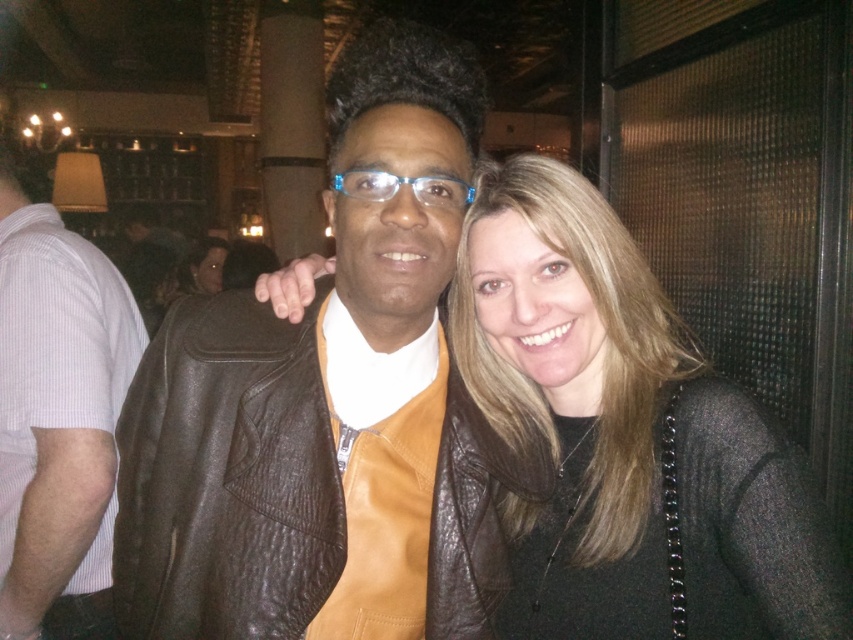
Question: Considering the real-world distances, which object is farthest from the leather jacket at center?

Choices:
 (A) brown leather jacket at center
 (B) matte black sweater at center

Answer: (B)

Question: Considering the real-world distances, which object is farthest from the matte black sweater at center?

Choices:
 (A) brown leather jacket at center
 (B) leather jacket at center

Answer: (B)

Question: Does brown leather jacket at center appear on the left side of leather jacket at center?

Choices:
 (A) no
 (B) yes

Answer: (A)

Question: Is matte black sweater at center wider than leather jacket at center?

Choices:
 (A) no
 (B) yes

Answer: (B)

Question: Which point is closer to the camera?

Choices:
 (A) brown leather jacket at center
 (B) leather jacket at center

Answer: (A)

Question: Can you confirm if matte black sweater at center is positioned to the right of leather jacket at center?

Choices:
 (A) yes
 (B) no

Answer: (A)